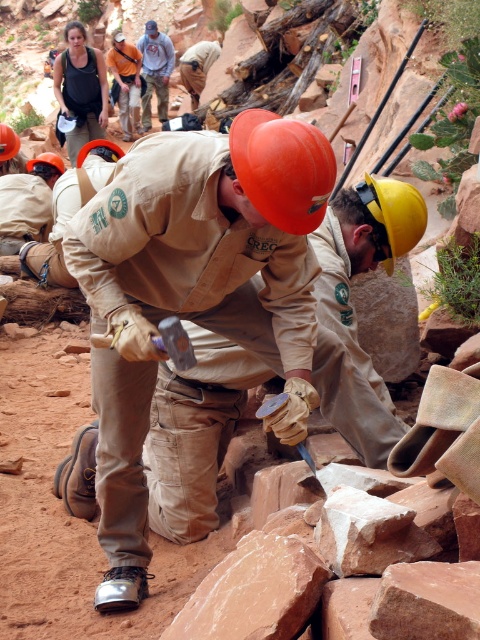
Question: Which point is farther from the camera taking this photo?

Choices:
 (A) (312, 225)
 (B) (9, 156)

Answer: (B)

Question: Does orange hard hat at center have a greater width compared to matte orange helmet at center?

Choices:
 (A) yes
 (B) no

Answer: (B)

Question: Does yellow matte helmet at center appear on the left side of matte gray shirt at center?

Choices:
 (A) yes
 (B) no

Answer: (B)

Question: Considering the real-world distances, which object is closest to the orange matte helmet at upper center?

Choices:
 (A) matte orange hard hat at center
 (B) yellow matte helmet at center

Answer: (A)

Question: In this image, where is orange hard hat at center located relative to orange matte helmet at upper center?

Choices:
 (A) below
 (B) above

Answer: (A)

Question: Which point appears farthest from the camera in this image?

Choices:
 (A) [303, 148]
 (B) [113, 42]

Answer: (B)